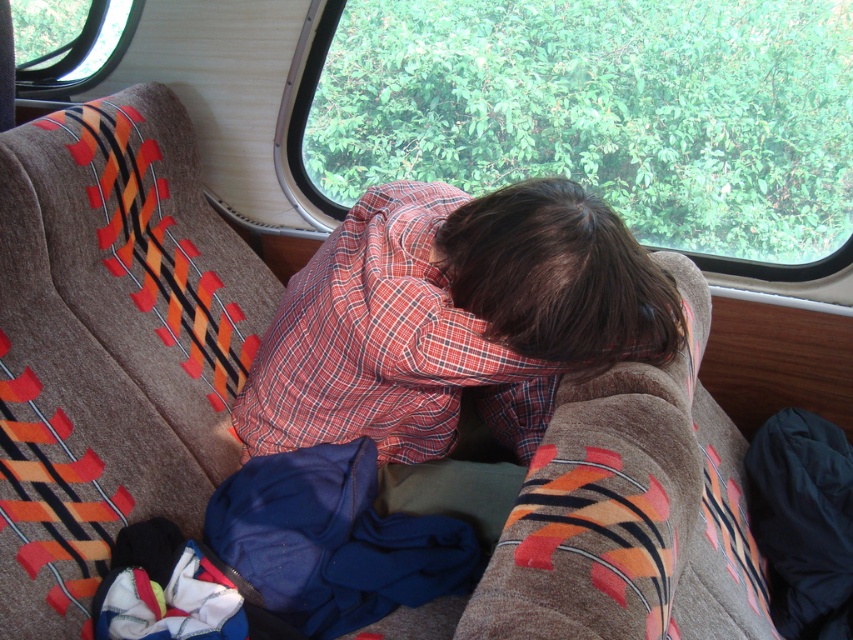
Question: Considering the real-world distances, which object is farthest from the red plaid shirt at center?

Choices:
 (A) blue fleece sleeping bag at lower center
 (B) black fabric at lower right

Answer: (B)

Question: Which object is the farthest from the blue fleece sleeping bag at lower center?

Choices:
 (A) black fabric at lower right
 (B) red plaid shirt at center

Answer: (A)

Question: In this image, where is red plaid shirt at center located relative to black fabric at lower right?

Choices:
 (A) left
 (B) right

Answer: (A)

Question: Which point is closer to the camera?

Choices:
 (A) (463, 547)
 (B) (552, 248)
 (C) (759, 502)

Answer: (B)

Question: Can you confirm if red plaid shirt at center is positioned to the left of blue fleece sleeping bag at lower center?

Choices:
 (A) yes
 (B) no

Answer: (B)

Question: Can you confirm if blue fleece sleeping bag at lower center is bigger than black fabric at lower right?

Choices:
 (A) yes
 (B) no

Answer: (B)